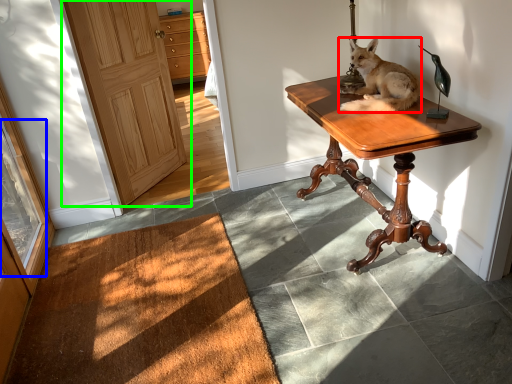
Question: Estimate the real-world distances between objects in this image. Which object is closer to dog (highlighted by a red box), glass door (highlighted by a blue box) or door (highlighted by a green box)?

Choices:
 (A) glass door
 (B) door

Answer: (B)